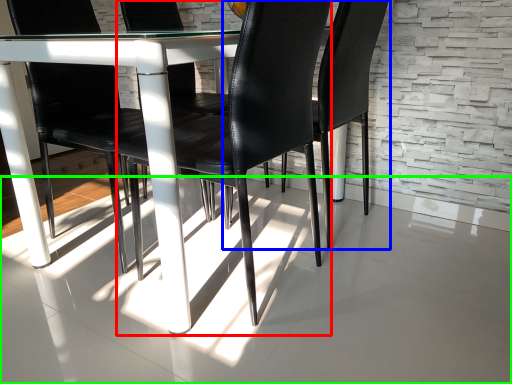
Question: Which is farther away from chair (highlighted by a red box)? chair (highlighted by a blue box) or concrete (highlighted by a green box)?

Choices:
 (A) chair
 (B) concrete

Answer: (A)